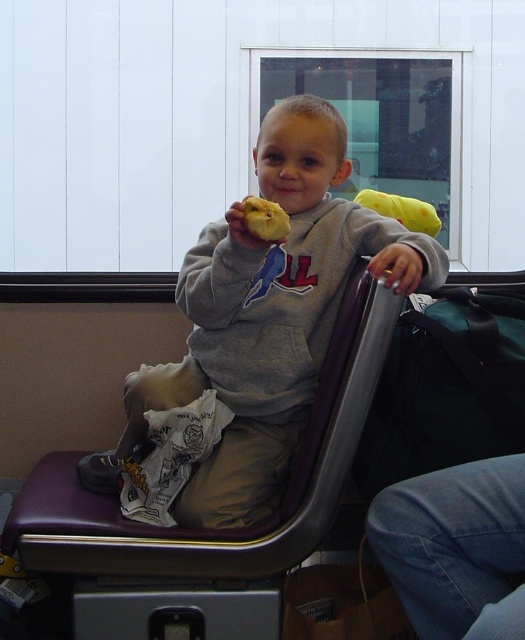
Question: Is gray fleece sweatshirt at center thinner than yellow crumbly pastry at center?

Choices:
 (A) no
 (B) yes

Answer: (A)

Question: From the image, what is the correct spatial relationship of gray fleece sweatshirt at center in relation to purple leather chair at center?

Choices:
 (A) above
 (B) below

Answer: (A)

Question: Among these objects, which one is nearest to the camera?

Choices:
 (A) purple leather chair at center
 (B) yellow crumbly pastry at center

Answer: (B)

Question: Is gray fleece sweatshirt at center further to the viewer compared to purple leather chair at center?

Choices:
 (A) yes
 (B) no

Answer: (B)

Question: Which of these objects is positioned farthest from the yellow crumbly pastry at center?

Choices:
 (A) gray fleece sweatshirt at center
 (B) purple leather chair at center

Answer: (B)

Question: Estimate the real-world distances between objects in this image. Which object is closer to the yellow crumbly pastry at center?

Choices:
 (A) purple leather chair at center
 (B) gray fleece sweatshirt at center

Answer: (B)